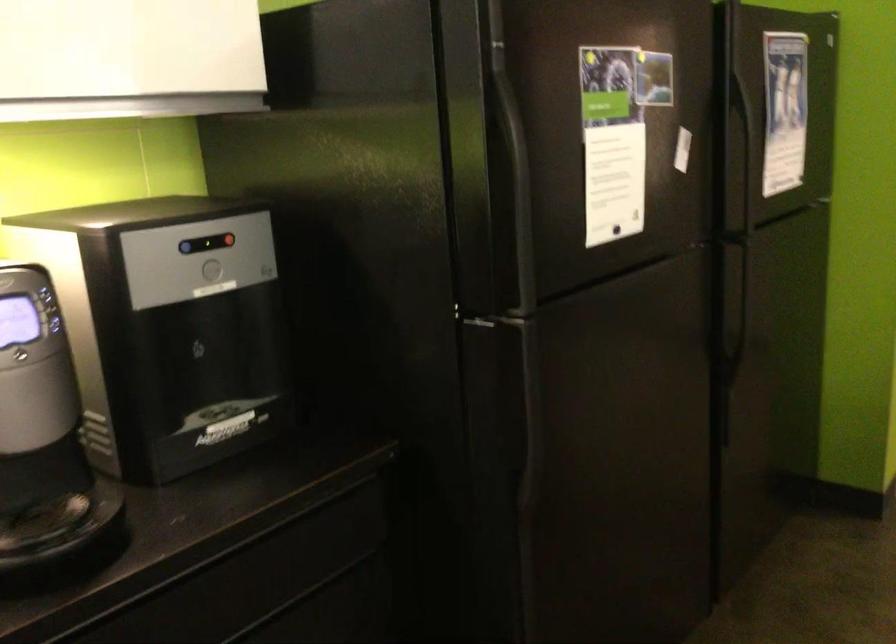
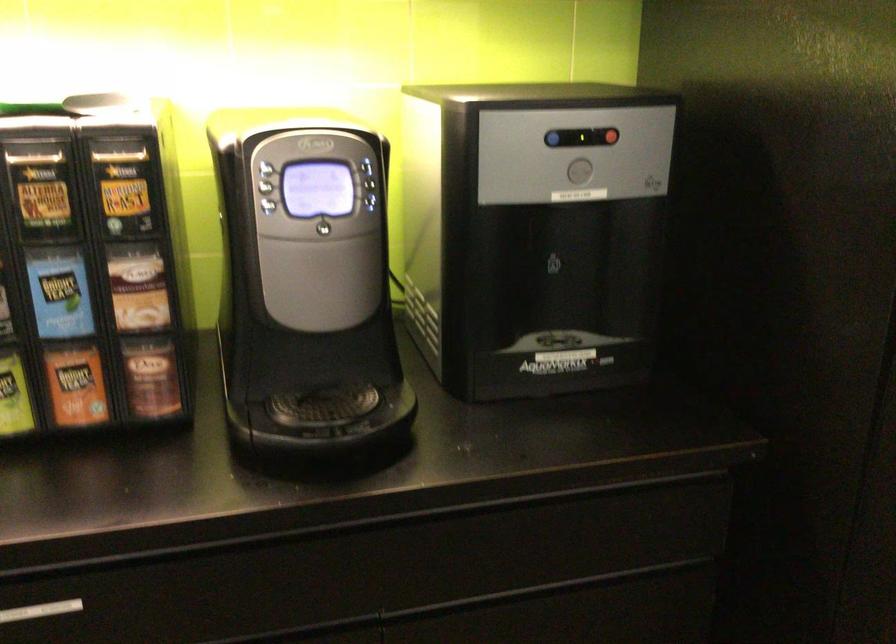
In the second image, find the point that corresponds to (x=229, y=240) in the first image.

(612, 136)